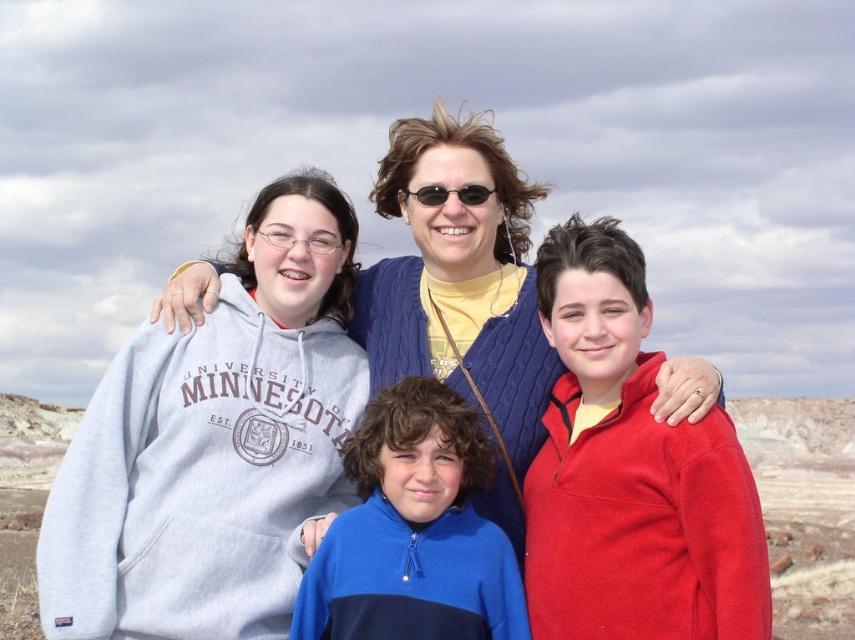
You are trying to decide which jacket to wear today based on the image. The matte red fleece jacket at right and the blue knit sweater at center are both options. Which one is thinner and more suitable for warmer weather?

The matte red fleece jacket at right is thinner than the blue knit sweater at center, so it would be more suitable for warmer weather.